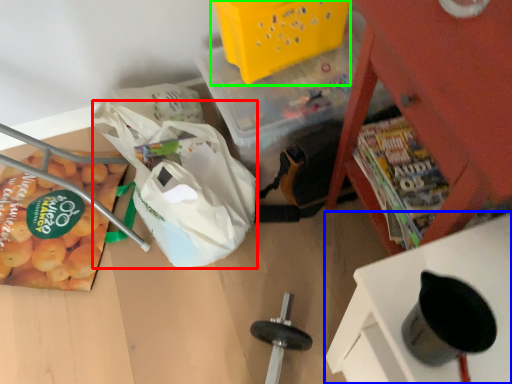
Question: Estimate the real-world distances between objects in this image. Which object is closer to grocery bag (highlighted by a red box), furniture (highlighted by a blue box) or basket (highlighted by a green box)?

Choices:
 (A) furniture
 (B) basket

Answer: (B)